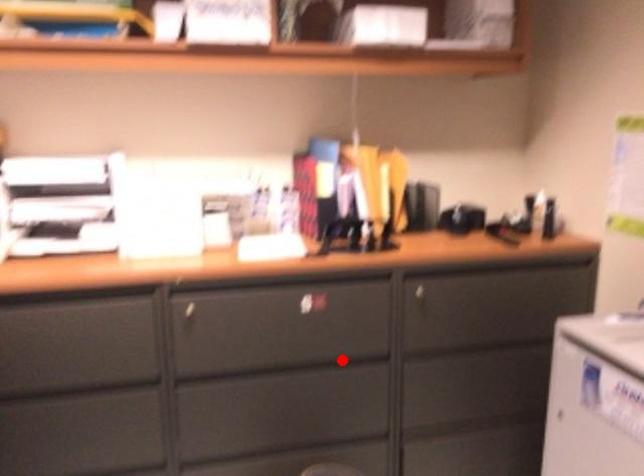
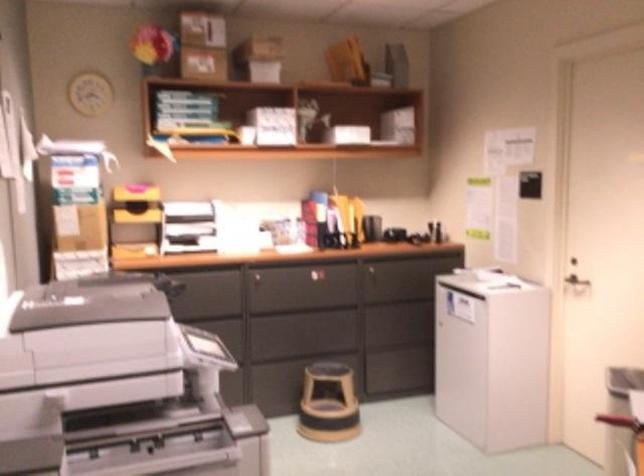
The point at the highlighted location is marked in the first image. Where is the corresponding point in the second image?

(335, 307)